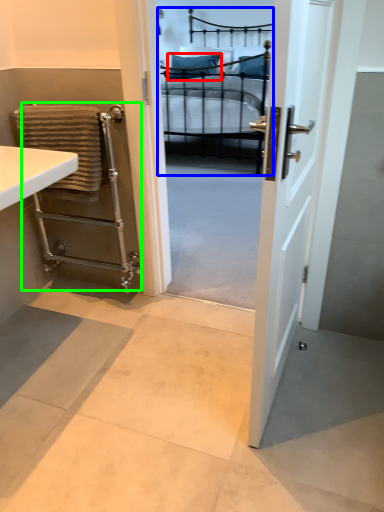
Question: Which is nearer to the pillow (highlighted by a red box)? bed (highlighted by a blue box) or balustrade (highlighted by a green box).

Choices:
 (A) bed
 (B) balustrade

Answer: (A)